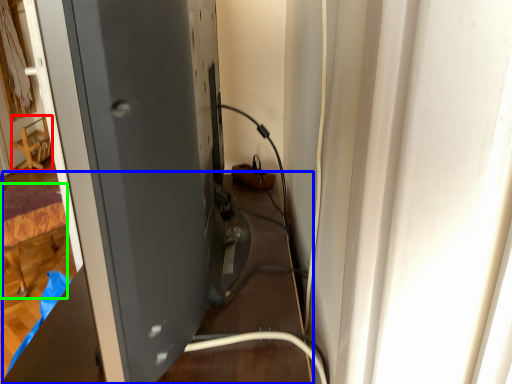
Question: Based on their relative distances, which object is nearer to furniture (highlighted by a red box)? Choose from table (highlighted by a blue box) and furniture (highlighted by a green box).

Choices:
 (A) table
 (B) furniture

Answer: (B)